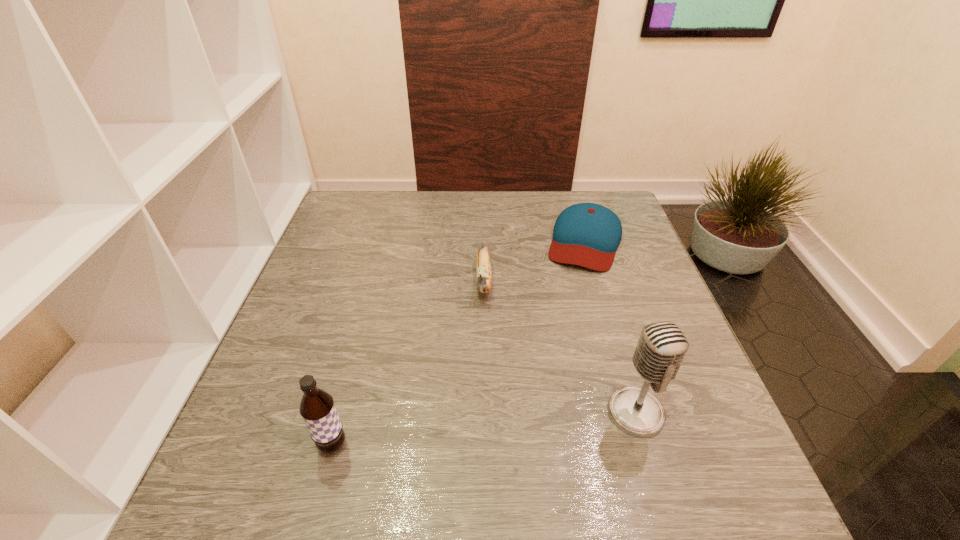
The image size is (960, 540). In order to click on free area in between the leftmost object and the tallest object in this screenshot , I will do `click(485, 429)`.

Find the location of a particular element. The image size is (960, 540). empty space that is in between the microphone and the baseball cap is located at coordinates (611, 327).

Where is `vacant region between the banana and the microphone`? The height and width of the screenshot is (540, 960). vacant region between the banana and the microphone is located at coordinates (560, 347).

Locate an element on the screen. empty space between the third shortest object and the banana is located at coordinates (409, 363).

The height and width of the screenshot is (540, 960). Identify the location of empty space that is in between the baseball cap and the banana. (535, 261).

At what (x,y) coordinates should I click in order to perform the action: click on vacant space that's between the leftmost object and the shortest object. Please return your answer as a coordinate pair (x, y). The height and width of the screenshot is (540, 960). Looking at the image, I should click on (459, 343).

The height and width of the screenshot is (540, 960). In order to click on vacant area that lies between the third object from right to left and the microphone in this screenshot , I will do `click(560, 347)`.

Identify the location of free space between the third shortest object and the baseball cap. The height and width of the screenshot is (540, 960). (459, 343).

You are a GUI agent. You are given a task and a screenshot of the screen. Output one action in this format:
    pyautogui.click(x=<x>, y=<y>)
    Task: Click on the third closest object to the tallest object
    Image resolution: width=960 pixels, height=540 pixels.
    Given the screenshot: What is the action you would take?
    pyautogui.click(x=317, y=408)

I want to click on object that stands as the third closest to the tallest object, so click(317, 408).